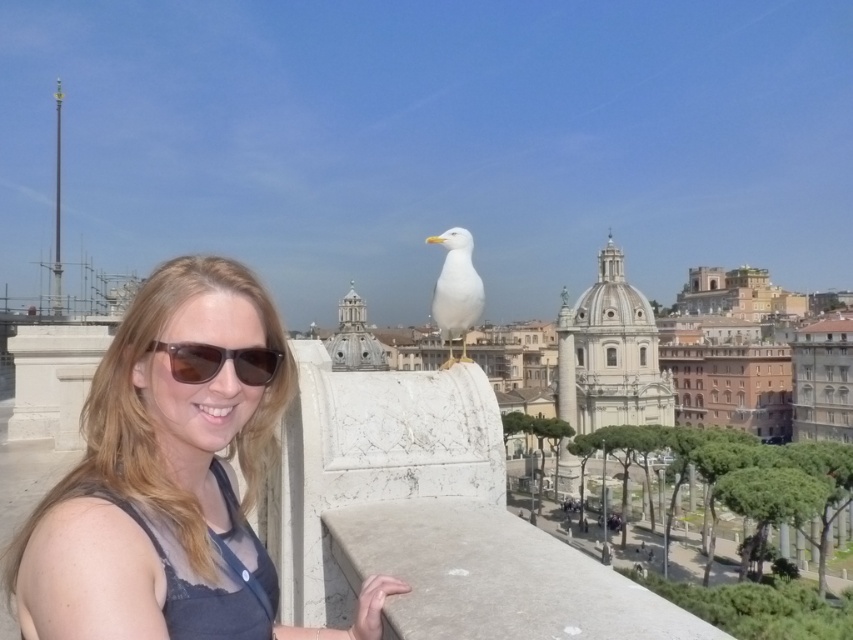
You are a photographer trying to capture a clear shot of the matte gray tank top at center and the white matte bird at center. Which object is closer to the camera, and why?

The matte gray tank top at center is closer to the camera because it is positioned in front of the white matte bird at center, which is further away.

You are a photographer trying to capture a clear shot of the matte gray tank top at center and the brown matte sunglasses at center. Which object is closer to the camera in the current composition?

The matte gray tank top at center is closer to the camera than the brown matte sunglasses at center because it is in front of it.